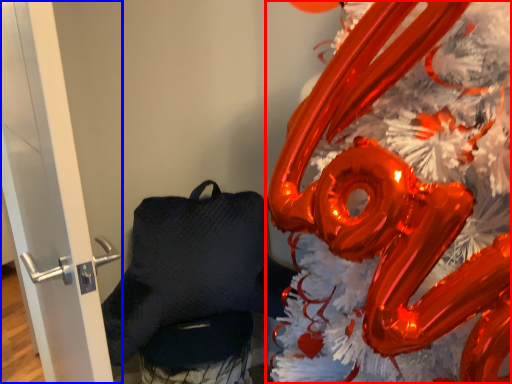
Question: Which point is further to the camera, christmas decoration (highlighted by a red box) or door (highlighted by a blue box)?

Choices:
 (A) christmas decoration
 (B) door

Answer: (B)